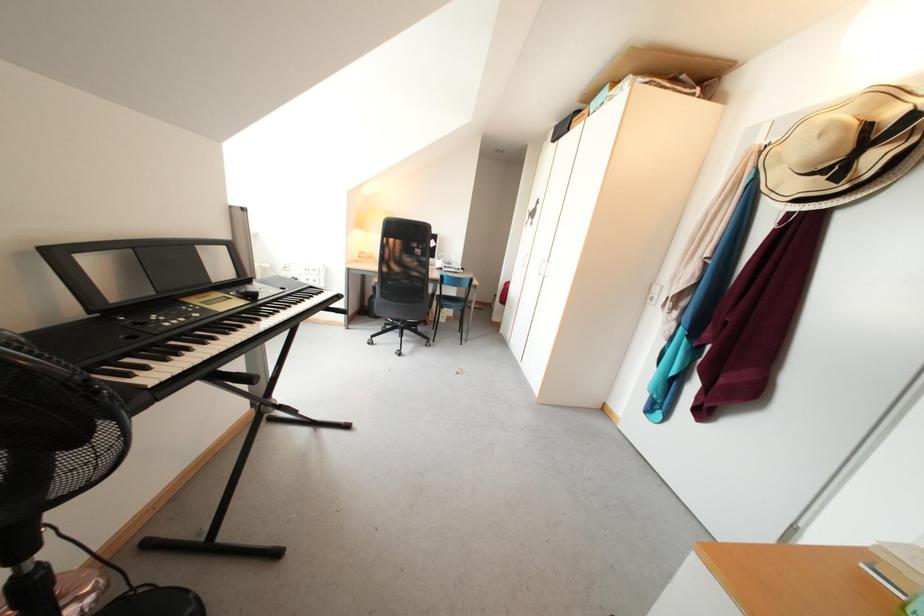
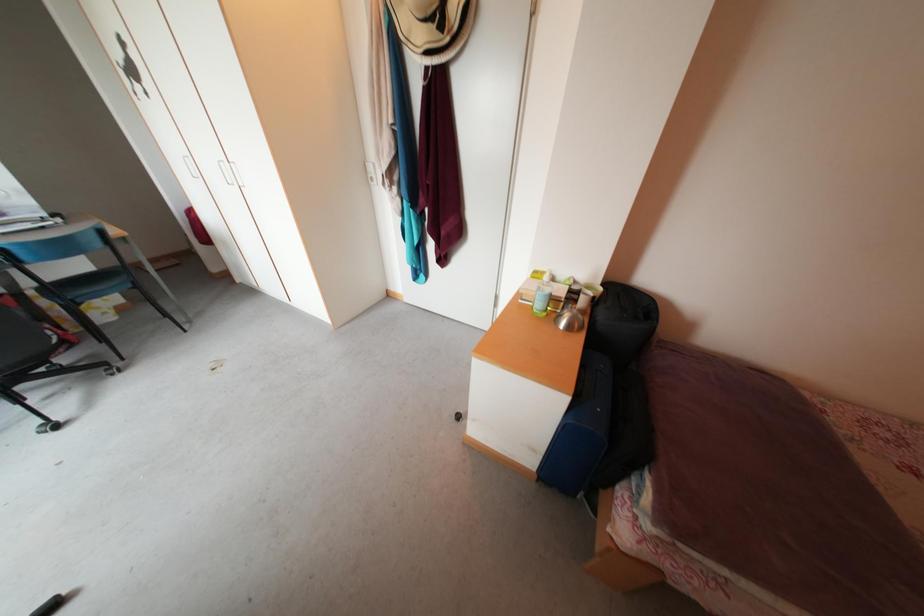
Based on the continuous images, in which direction is the camera rotating?

The rotation direction of the camera is right-down.